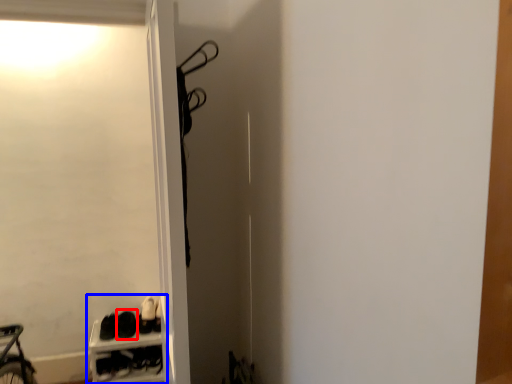
Question: Which point is further to the camera, footwear (highlighted by a red box) or bookshelf (highlighted by a blue box)?

Choices:
 (A) footwear
 (B) bookshelf

Answer: (A)